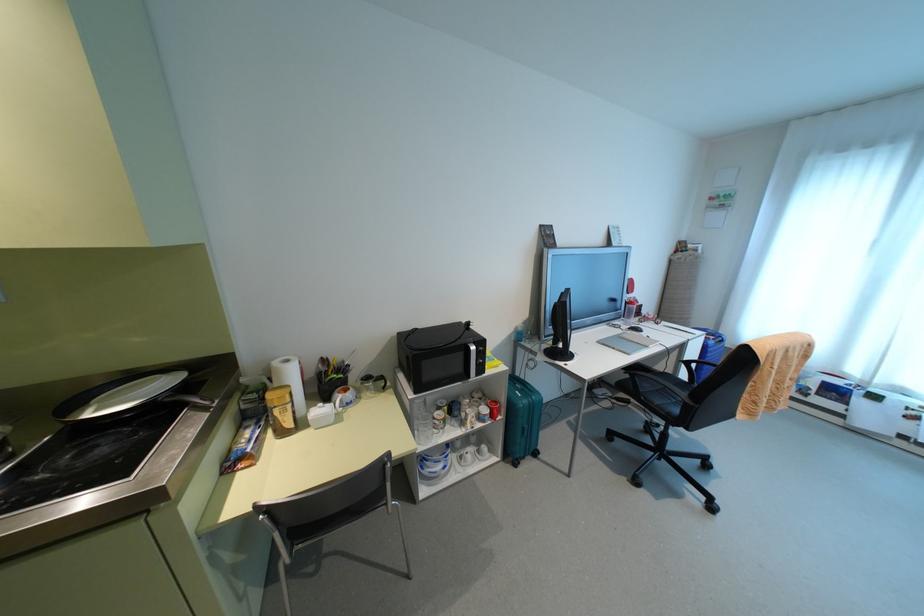
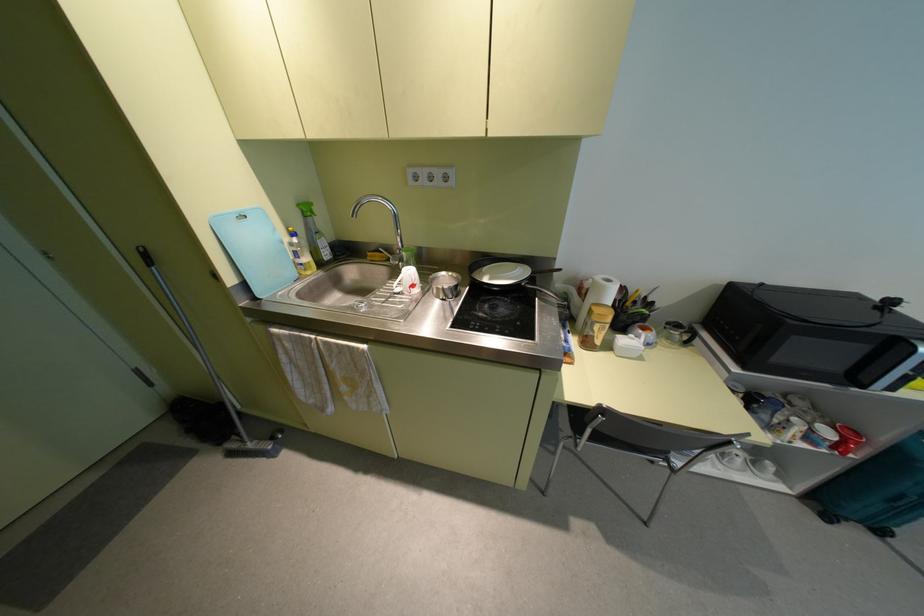
Where in the second image is the point corresponding to the point at 383,387 from the first image?

(686, 342)